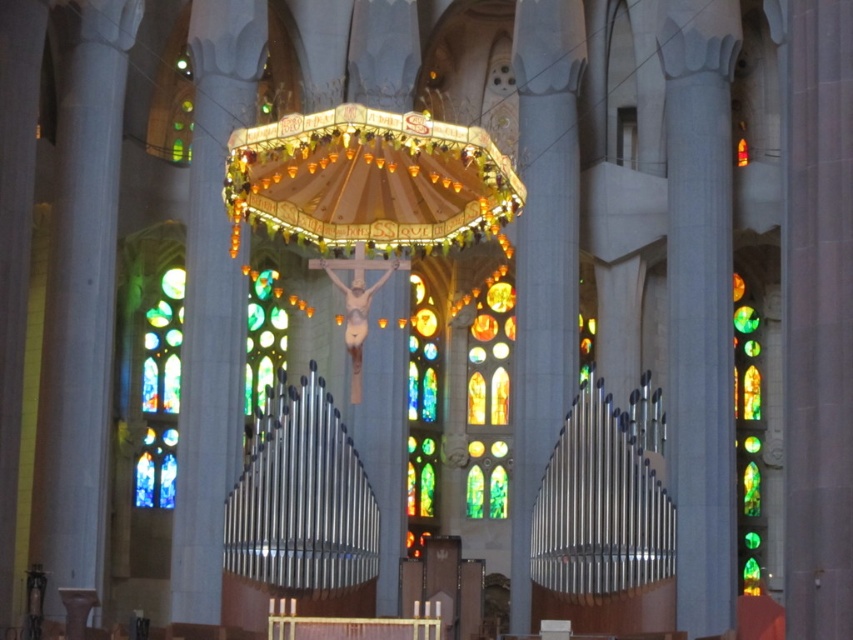
Question: Which object appears closest to the camera in this image?

Choices:
 (A) stained glass at left
 (B) stained glass window at right

Answer: (B)

Question: Can you confirm if translucent stained glass at center is positioned to the right of multicolored stained glass at center?

Choices:
 (A) yes
 (B) no

Answer: (A)

Question: Which point is closer to the camera?

Choices:
 (A) (416, 298)
 (B) (248, 324)
 (C) (747, 548)

Answer: (B)

Question: Is translucent stained glass at center further to the viewer compared to stained glass at left?

Choices:
 (A) no
 (B) yes

Answer: (B)

Question: Does stained glass window at right have a larger size compared to stained glass window at center?

Choices:
 (A) no
 (B) yes

Answer: (B)

Question: Considering the real-world distances, which object is farthest from the stained glass window at center?

Choices:
 (A) stained glass window at right
 (B) multicolored stained glass at center
 (C) stained glass at left
 (D) translucent stained glass at center

Answer: (A)